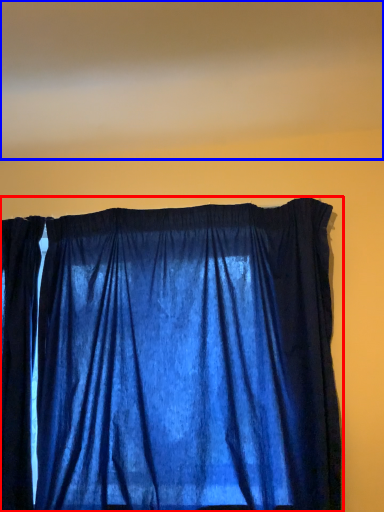
Question: Which object is closer to the camera taking this photo, curtain (highlighted by a red box) or blind (highlighted by a blue box)?

Choices:
 (A) curtain
 (B) blind

Answer: (B)